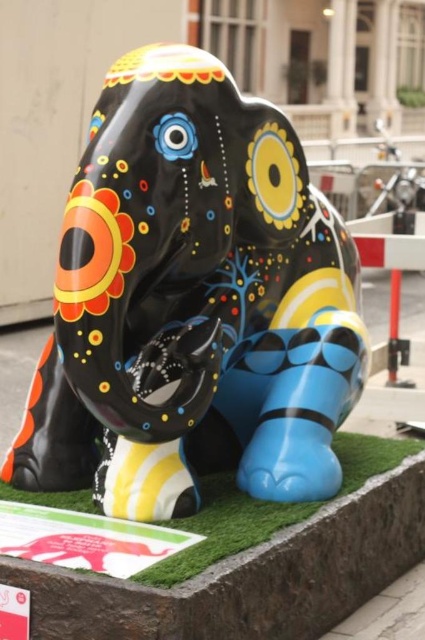
You are a landscape designer planning to place a new bench in the area. The bench requires a space wider than the glossy painted elephant at center. Can the green artificial turf at lower center accommodate the bench?

The glossy painted elephant at center is narrower than the green artificial turf at lower center, so the green artificial turf at lower center can accommodate the bench since it is wider than the elephant.

You are standing in front of the glossy painted elephant at center with a camera that has a 3.5 feet focal length. Can you take a clear photo of the elephant without moving the camera?

The distance between you and the glossy painted elephant at center is 4.24 feet, which is greater than the camera focal length of 3.5 feet. Therefore, you can take a clear photo of the glossy painted elephant at center without moving the camera.

You are a landscape architect designing a garden. You need to place a new statue that is 1.5 meters tall. The glossy painted elephant at center is currently occupying the central area. Can the green artificial turf at lower center accommodate the new statue without overlapping the elephant?

The glossy painted elephant at center is bigger than the green artificial turf at lower center. Since the elephant is larger, the turf area might not have enough space to place the 1.5 meter statue without overlapping. Please consider a different location.